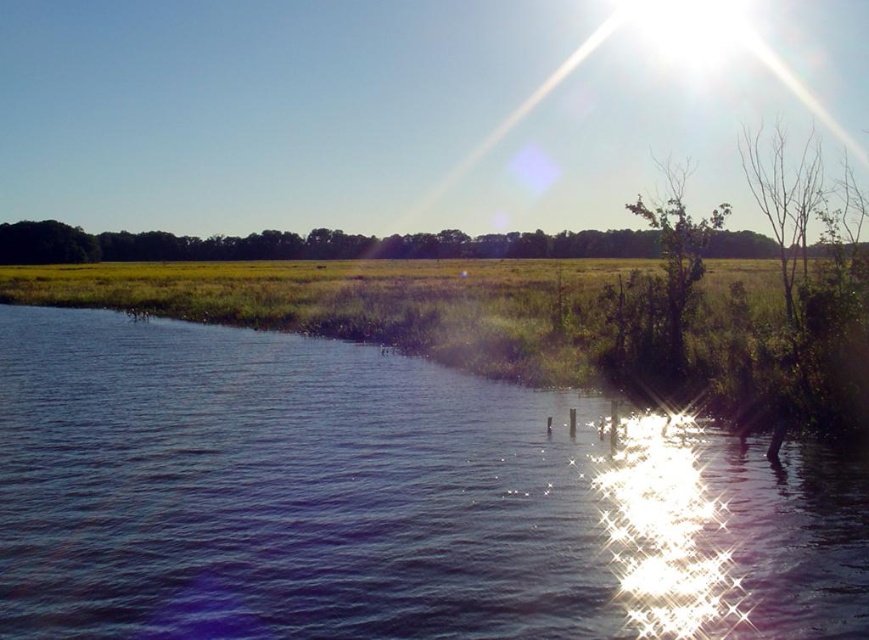
Question: Is green matte tree at upper center to the left of bare branches at upper right from the viewer's perspective?

Choices:
 (A) yes
 (B) no

Answer: (A)

Question: Which point appears farthest from the camera in this image?

Choices:
 (A) (664, 301)
 (B) (595, 550)
 (C) (738, 243)

Answer: (C)

Question: Is blue water at center above bare branches at upper right?

Choices:
 (A) no
 (B) yes

Answer: (A)

Question: Which point appears farthest from the camera in this image?

Choices:
 (A) (269, 237)
 (B) (857, 572)

Answer: (A)

Question: Can you confirm if blue water at center is thinner than bare branches at upper right?

Choices:
 (A) yes
 (B) no

Answer: (A)

Question: Based on their relative distances, which object is farther from the blue water at center?

Choices:
 (A) green matte tree at upper center
 (B) bare branches at upper right
 (C) green leafy tree at upper right

Answer: (A)